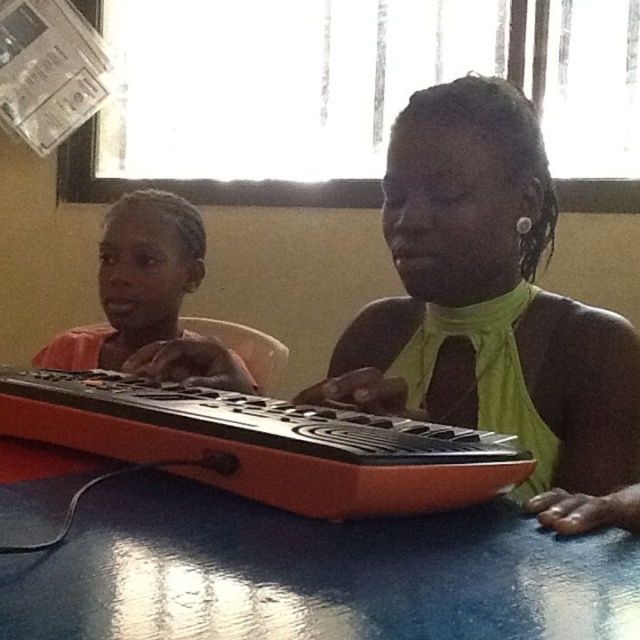
Question: Which of the following is the farthest from the observer?

Choices:
 (A) blue glossy table at lower center
 (B) orange matte keyboard at center
 (C) orange matte keyboard at left

Answer: (C)

Question: Estimate the real-world distances between objects in this image. Which object is closer to the orange matte keyboard at left?

Choices:
 (A) orange matte keyboard at center
 (B) blue glossy table at lower center

Answer: (A)

Question: Is orange matte keyboard at center thinner than orange matte keyboard at left?

Choices:
 (A) no
 (B) yes

Answer: (B)

Question: Which object is the closest to the blue glossy table at lower center?

Choices:
 (A) orange matte keyboard at left
 (B) orange matte keyboard at center

Answer: (B)

Question: Is the position of blue glossy table at lower center more distant than that of orange matte keyboard at left?

Choices:
 (A) no
 (B) yes

Answer: (A)

Question: In this image, where is orange matte keyboard at center located relative to orange matte keyboard at left?

Choices:
 (A) left
 (B) right

Answer: (B)